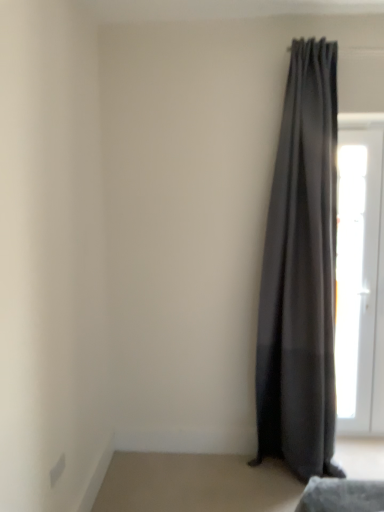
The width and height of the screenshot is (384, 512). In order to click on free space underneath white glossy door at right (from a real-world perspective) in this screenshot , I will do `click(351, 441)`.